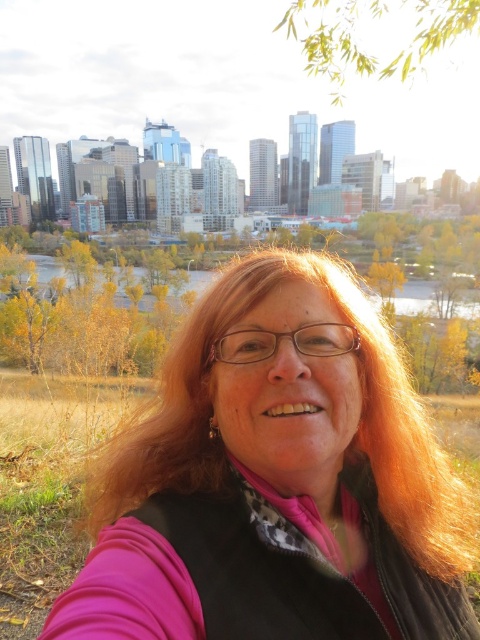
You are standing in the city square and want to take a photo of the point at coordinates (x=312, y=548). Your camera has a maximum zoom range of 120 meters. Will you be able to capture the point clearly without moving closer?

The point at coordinates (x=312, y=548) is 145.16 meters away from the viewer. Since the camera can only zoom up to 120 meters, you will not be able to capture it clearly without moving closer.